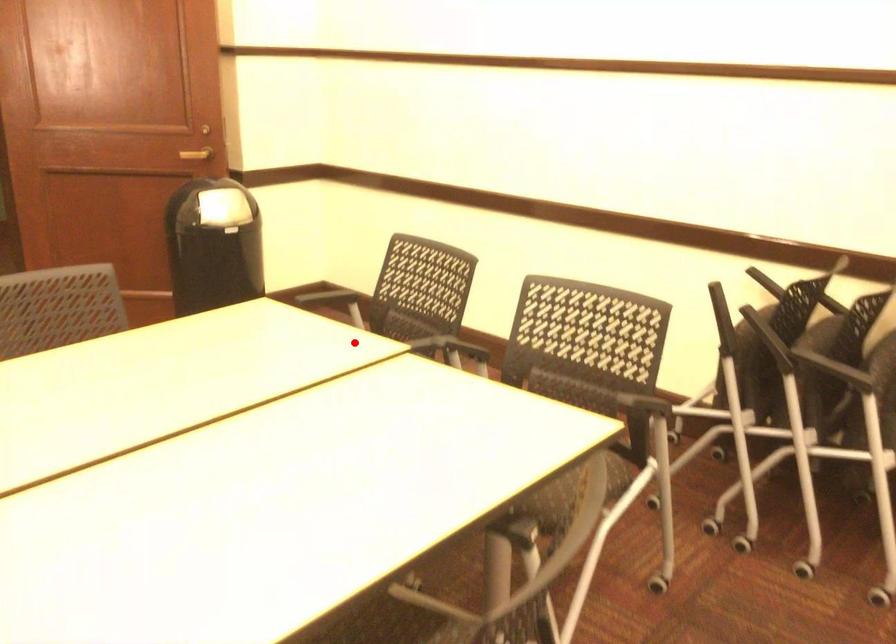
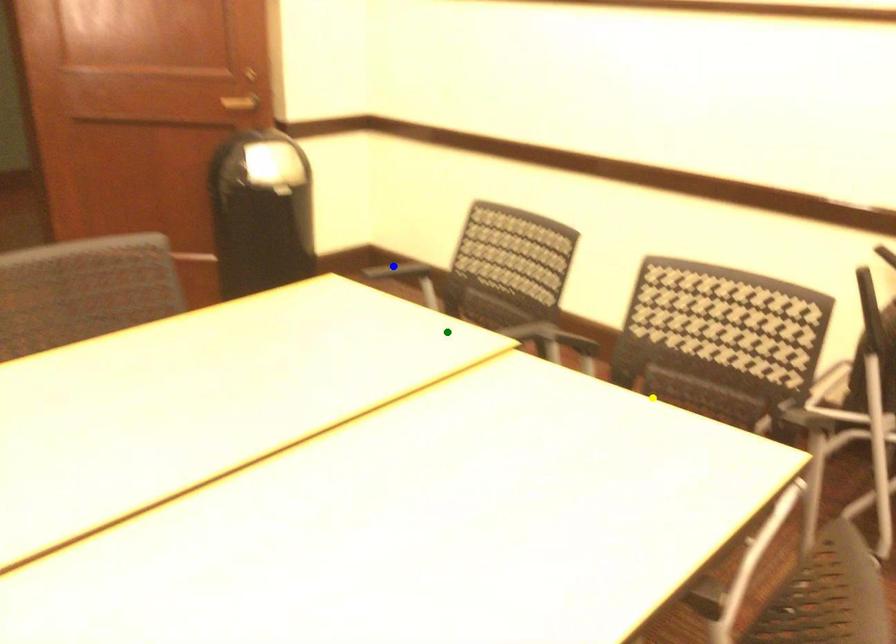
Question: I am providing you with two images of the same scene from different viewpoints. A red point is marked on the first image. You are given multiple points on the second image. Which mark in image 2 goes with the point in image 1?

Choices:
 (A) green point
 (B) blue point
 (C) yellow point

Answer: (A)